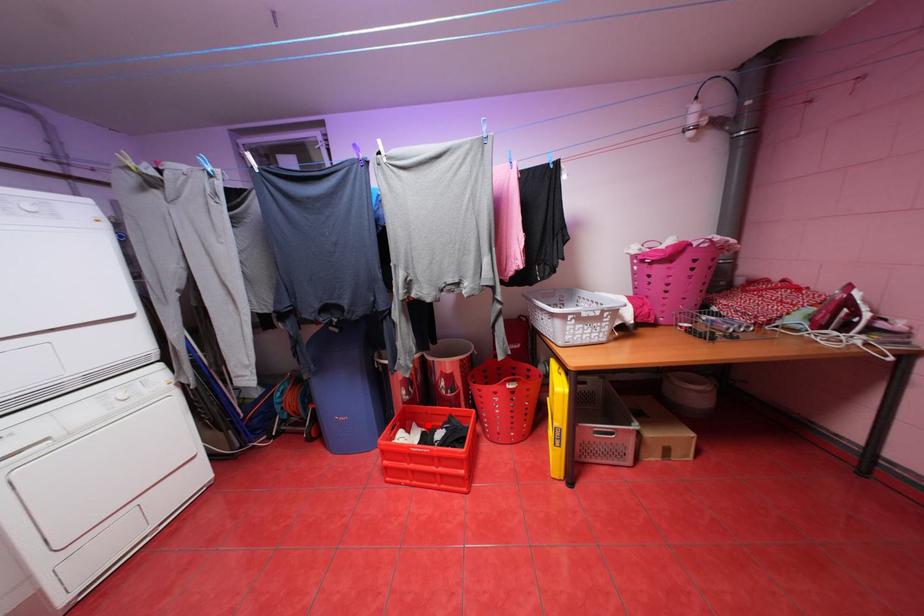
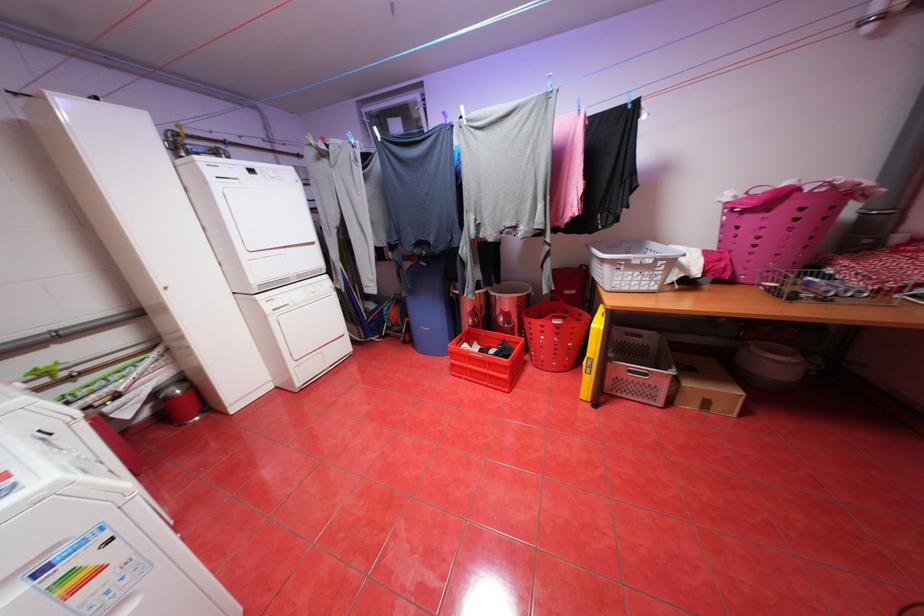
The point at the highlighted location is marked in the first image. Where is the corresponding point in the second image?

(488, 344)